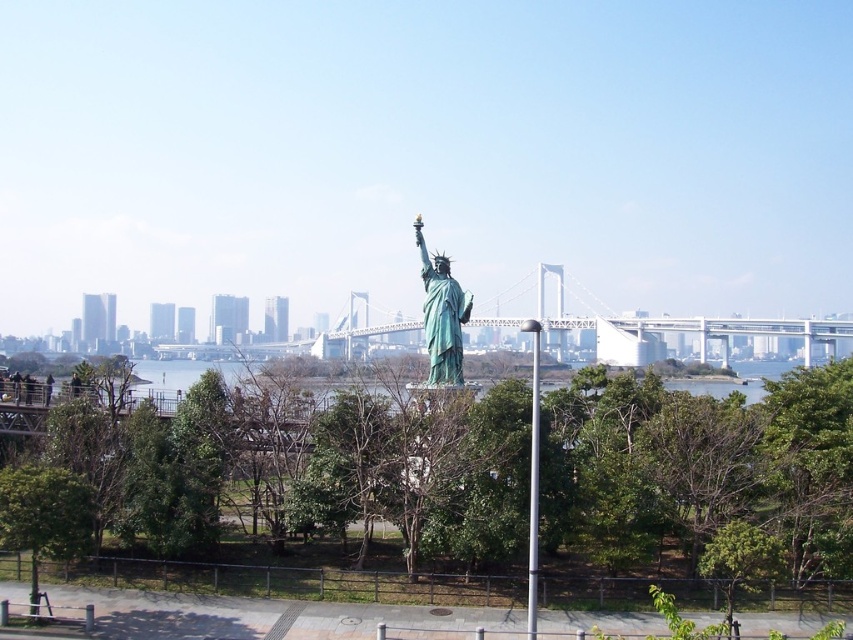
Question: Considering the relative positions of green leafy tree at center and green polished metal statue at center in the image provided, where is green leafy tree at center located with respect to green polished metal statue at center?

Choices:
 (A) below
 (B) above

Answer: (A)

Question: Is green leafy tree at lower left bigger than green polished metal statue at center?

Choices:
 (A) no
 (B) yes

Answer: (B)

Question: Which point appears farthest from the camera in this image?

Choices:
 (A) (440, 381)
 (B) (457, 483)
 (C) (535, 477)
 (D) (4, 497)

Answer: (A)

Question: Which is nearer to the green leafy tree at center?

Choices:
 (A) green polished metal statue at center
 (B) silver metallic pole at center
 (C) green leafy tree at lower left

Answer: (B)

Question: Can you confirm if green leafy tree at center is positioned below green leafy tree at lower left?

Choices:
 (A) yes
 (B) no

Answer: (B)

Question: Which point is farther from the camera taking this photo?

Choices:
 (A) (257, 445)
 (B) (527, 588)
 (C) (80, 506)
 (D) (457, 284)

Answer: (D)